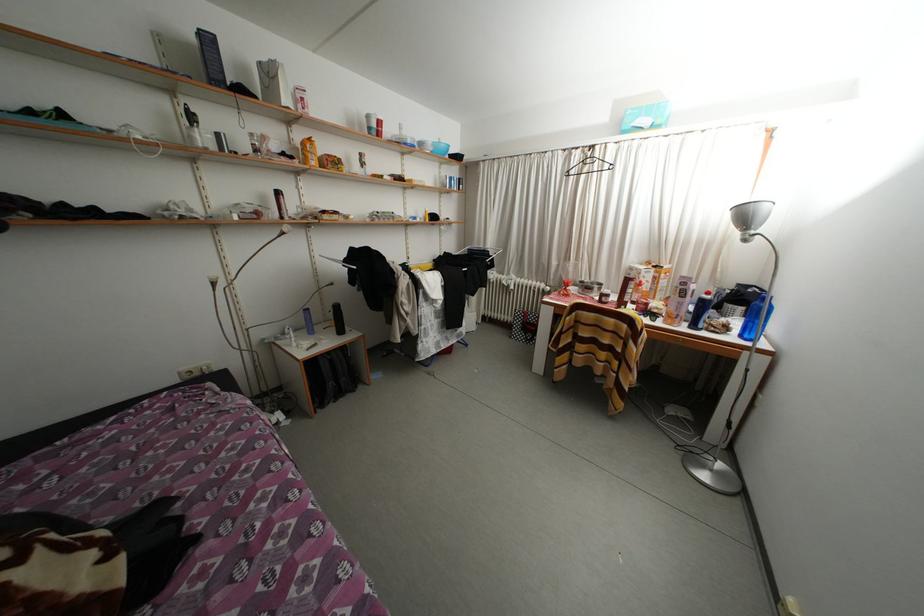
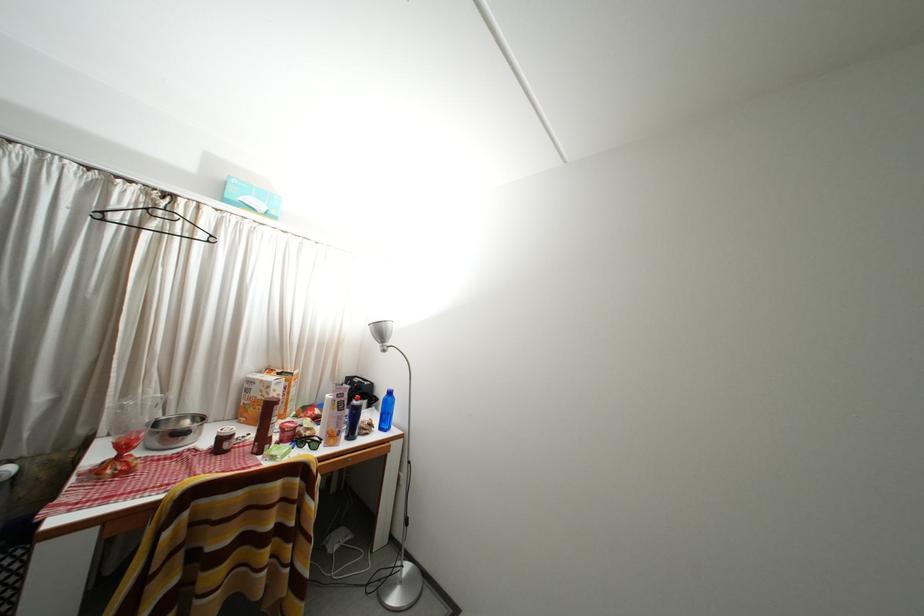
Find the pixel in the second image that matches point 592,175 in the first image.

(161, 230)